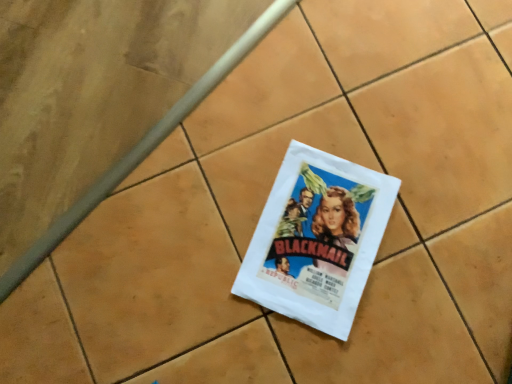
Describe the element at coordinates (317, 239) in the screenshot. Image resolution: width=512 pixels, height=384 pixels. I see `white paper poster at center` at that location.

Where is `white paper poster at center`? The height and width of the screenshot is (384, 512). white paper poster at center is located at coordinates (317, 239).

I want to click on white paper poster at center, so click(x=317, y=239).